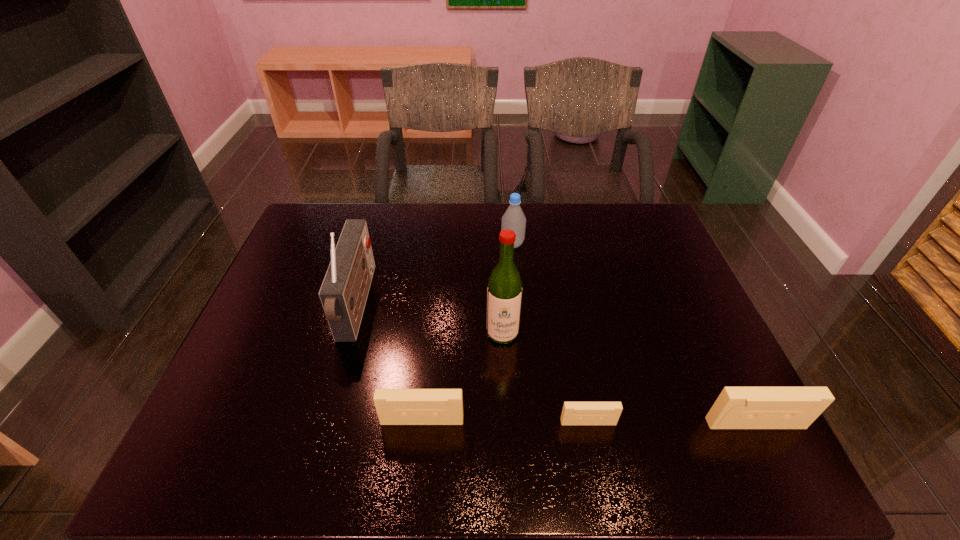
You are a GUI agent. You are given a task and a screenshot of the screen. Output one action in this format:
    pyautogui.click(x=<x>, y=<y>)
    Task: Click on the free region at the near left corner of the desktop
    Image resolution: width=960 pixels, height=540 pixels.
    Given the screenshot: What is the action you would take?
    pyautogui.click(x=274, y=408)

Where is `blank space at the far right corner`? blank space at the far right corner is located at coordinates (621, 226).

Image resolution: width=960 pixels, height=540 pixels. What are the coordinates of `blank region between the second object from right to left and the radio receiver` in the screenshot? It's located at (473, 364).

Find the location of a particular element. free area in between the rightmost videotape and the shortest object is located at coordinates (672, 423).

This screenshot has width=960, height=540. I want to click on free space between the liquor and the leftmost object, so click(x=430, y=319).

This screenshot has height=540, width=960. What are the coordinates of `vacant area that lies between the fourth shortest object and the rightmost videotape` in the screenshot? It's located at [634, 334].

The width and height of the screenshot is (960, 540). I want to click on free space between the tallest object and the second videotape from right to left, so click(x=545, y=378).

Locate an element on the screen. vacant area that lies between the rightmost videotape and the bottle is located at coordinates (634, 334).

The width and height of the screenshot is (960, 540). I want to click on free space between the bottle and the shortest object, so click(x=550, y=333).

Find the location of a particular element. The width and height of the screenshot is (960, 540). vacant space that's between the rightmost videotape and the shortest videotape is located at coordinates (672, 423).